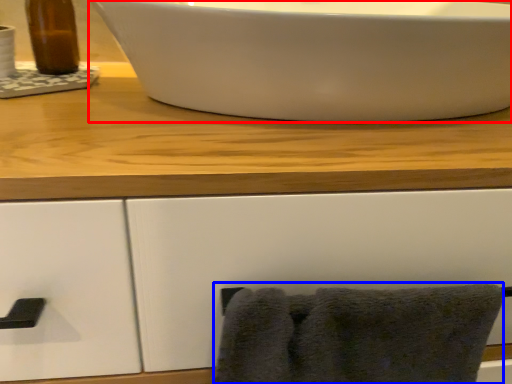
Question: Which point is closer to the camera, sink (highlighted by a red box) or bath towel (highlighted by a blue box)?

Choices:
 (A) sink
 (B) bath towel

Answer: (A)